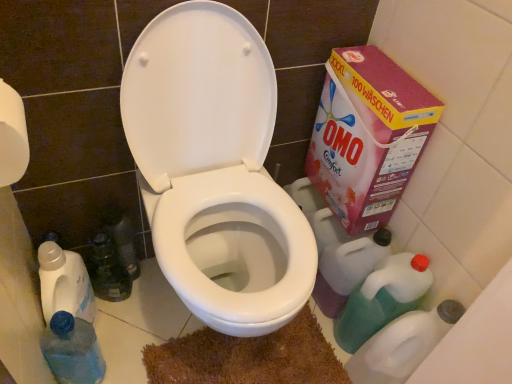
Locate an element on the screen. The image size is (512, 384). blank space above brown shaggy bath mat at center (from a real-world perspective) is located at coordinates (254, 357).